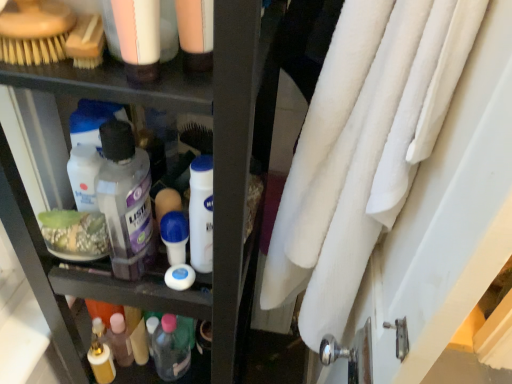
Question: From a real-world perspective, is translucent plastic bottle at lower center, acting as the fourth toiletry starting from the front, physically located above or below matte plastic lotion at upper left, the fourth toiletry positioned from the back?

Choices:
 (A) below
 (B) above

Answer: (A)

Question: Considering the positions of point (167, 375) and point (141, 23), is point (167, 375) closer or farther from the camera than point (141, 23)?

Choices:
 (A) closer
 (B) farther

Answer: (B)

Question: Considering the real-world distances, which object is closest to the green matte soap dish at center-left, the 2th product when ordered from right to left?

Choices:
 (A) transparent plastic mouthwash at center
 (B) white fluffy towel at right
 (C) matte plastic lotion at upper left, the fourth toiletry positioned from the back
 (D) translucent plastic bottle at lower center, which is counted as the 1th toiletry, starting from the back
 (E) blue rubber duster at center, which is counted as the 3th toiletry, starting from the front

Answer: (A)

Question: Which of these objects is positioned farthest from the green matte soap dish at center-left, placed as the second product when sorted from bottom to top?

Choices:
 (A) white fluffy towel at right
 (B) matte plastic lotion at upper left, the fourth toiletry positioned from the back
 (C) translucent plastic bottle at lower center, the fourth toiletry positioned from the top
 (D) white matte lotion at center, the third toiletry when ordered from back to front
 (E) blue rubber duster at center, the second toiletry in the bottom-to-top sequence

Answer: (A)